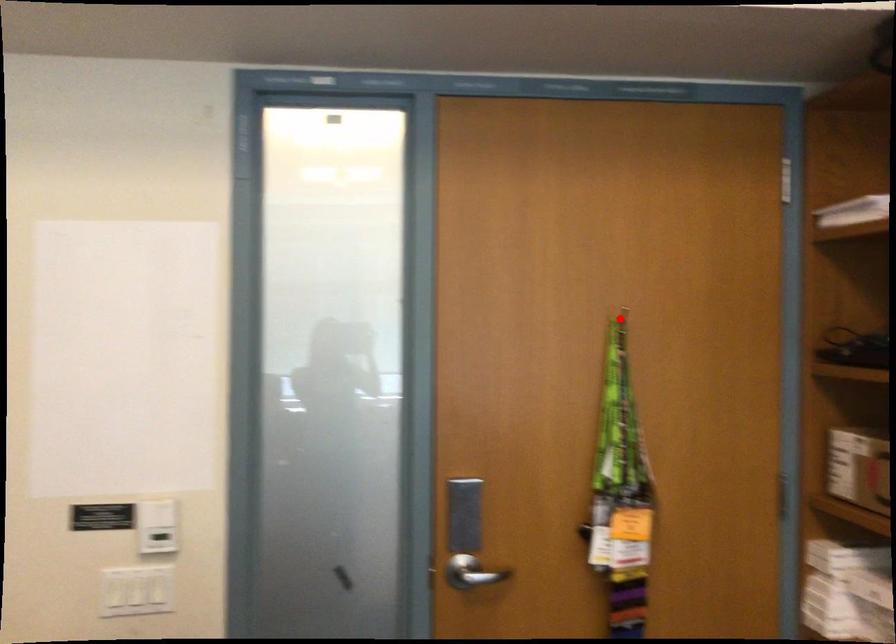
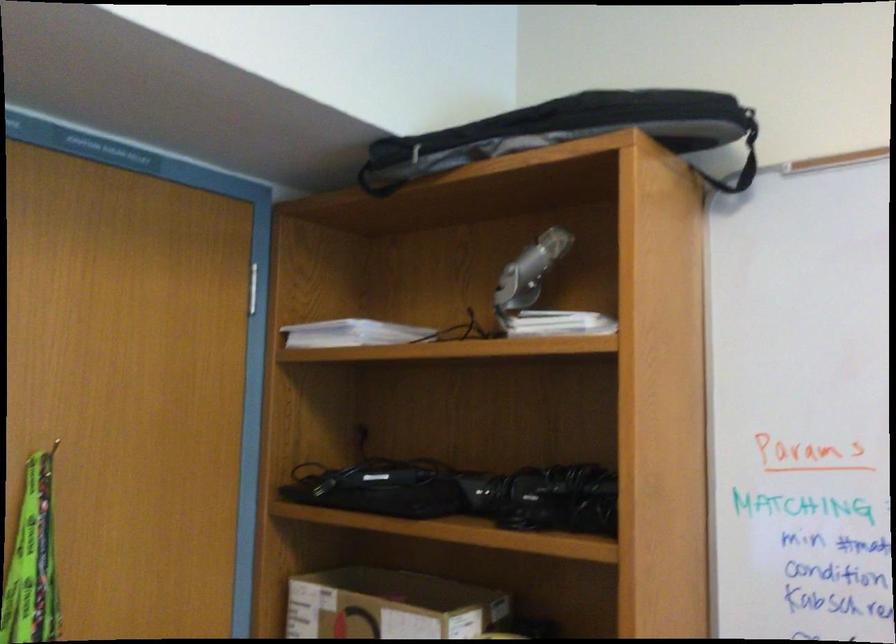
The point at the highlighted location is marked in the first image. Where is the corresponding point in the second image?

(53, 448)